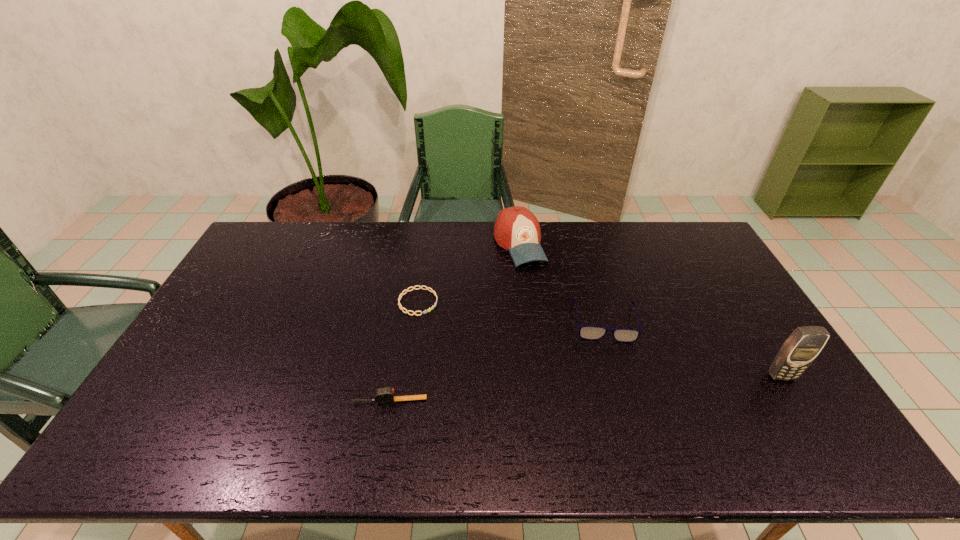
Find the location of a particular element. This screenshot has height=540, width=960. tape measure is located at coordinates (386, 395).

Find the location of a particular element. The width and height of the screenshot is (960, 540). the nearest object is located at coordinates 386,395.

This screenshot has width=960, height=540. I want to click on the second nearest object, so click(x=801, y=348).

Where is `the rightmost object`? The image size is (960, 540). the rightmost object is located at coordinates (801, 348).

I want to click on the third object from right to left, so click(516, 229).

This screenshot has height=540, width=960. I want to click on baseball cap, so click(516, 229).

Locate an element on the screen. the third tallest object is located at coordinates (588, 332).

This screenshot has width=960, height=540. I want to click on spectacles, so click(x=588, y=332).

At what (x,y) coordinates should I click in order to perform the action: click on the shortest object. Please return your answer as a coordinate pair (x, y). Looking at the image, I should click on (420, 287).

I want to click on vacant space located 0.300m on the right of the second shortest object, so click(x=543, y=401).